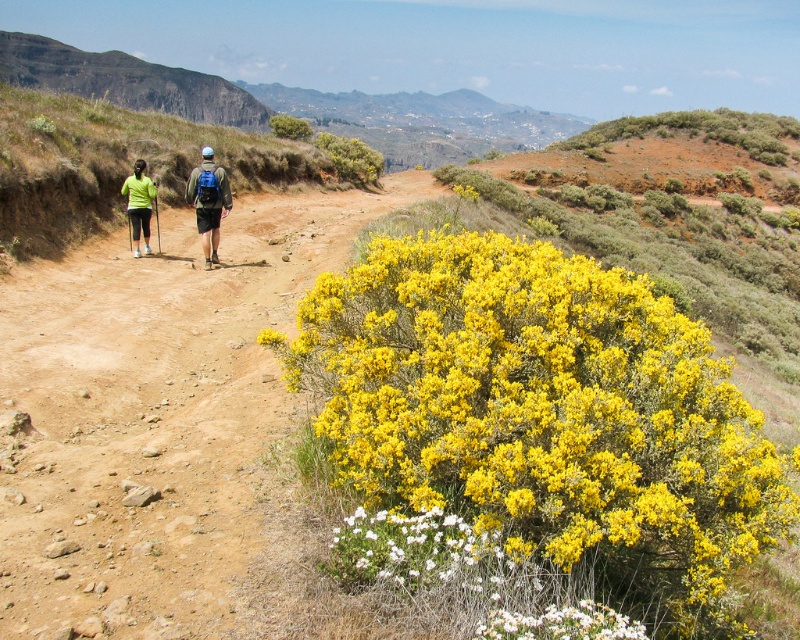
Question: Does rugged rock cliff at upper left appear on the left side of matte blue backpack at center?

Choices:
 (A) yes
 (B) no

Answer: (A)

Question: Which point appears farthest from the camera in this image?

Choices:
 (A) (560, 627)
 (B) (193, 177)
 (C) (148, 205)

Answer: (C)

Question: Which object appears closest to the camera in this image?

Choices:
 (A) white matte flower at lower center
 (B) green fabric shirt at upper left
 (C) yellow bush at right
 (D) matte black shorts at left

Answer: (A)

Question: Is white matte flower at lower center smaller than matte black shorts at left?

Choices:
 (A) no
 (B) yes

Answer: (B)

Question: Is yellow bush at right wider than matte blue backpack at center?

Choices:
 (A) no
 (B) yes

Answer: (B)

Question: Which object appears farthest from the camera in this image?

Choices:
 (A) matte black shorts at left
 (B) rugged rock cliff at upper left

Answer: (B)